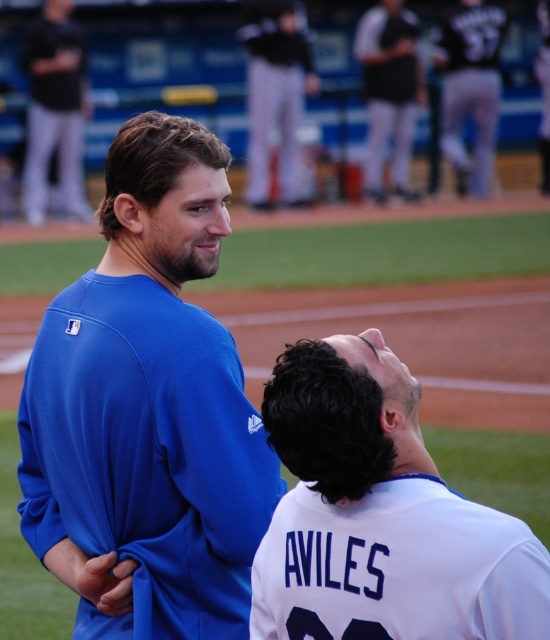
You are a photographer standing at the edge of the baseball field. You want to take a photo that includes both the black matte pants at upper left and the black jersey at upper center. Based on their current positions, can you fit both subjects into your camera frame if your camera has a maximum horizontal field of view of 4 meters?

The distance between the black matte pants at upper left and the black jersey at upper center is 4.52 meters. Since the camera has a maximum horizontal field of view of 4 meters, which is shorter than the distance between them, you cannot fit both subjects into the frame at the same time.

You are standing at the point labeled as point (x=59, y=124) on the baseball field. A drone is flying overhead and needs to hover exactly 100 feet away from you. Can the drone safely hover at this distance without being too close?

The distance of point (x=59, y=124) from viewer is 84.27 feet. Since the drone needs to hover at 100 feet away, which is farther than the current distance, the drone can safely hover at the required distance.